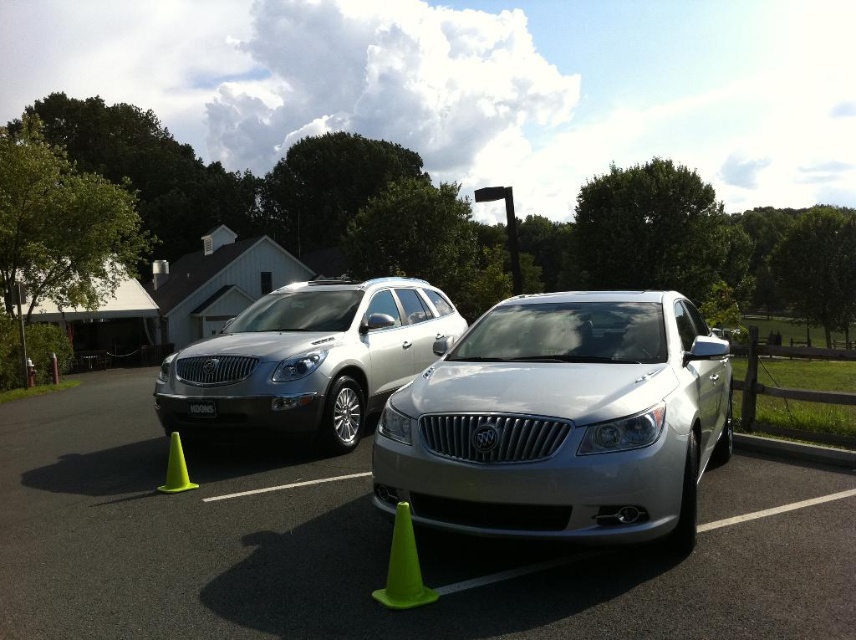
You are standing in front of two Buick vehicles in a parking lot. You notice two points marked on the image. The first point is at coordinates point (468, 388) and the second point is at point (423, 344). Which of these two points is nearer to your current position?

Point (468, 388) is closer to the camera than point (423, 344), so the first point is nearer to your current position.

You are a photographer standing at the edge of the parking lot. You want to take a photo of the satin silver car at center from a distance that ensures it fills the frame without being too close. Given that the ideal framing distance for this car model is between 8 to 10 feet, is your current position suitable?

The satin silver car at center is 9.75 feet away from the camera, which falls within the ideal framing distance of 8 to 10 feet. Therefore, your current position is suitable for taking the photo.